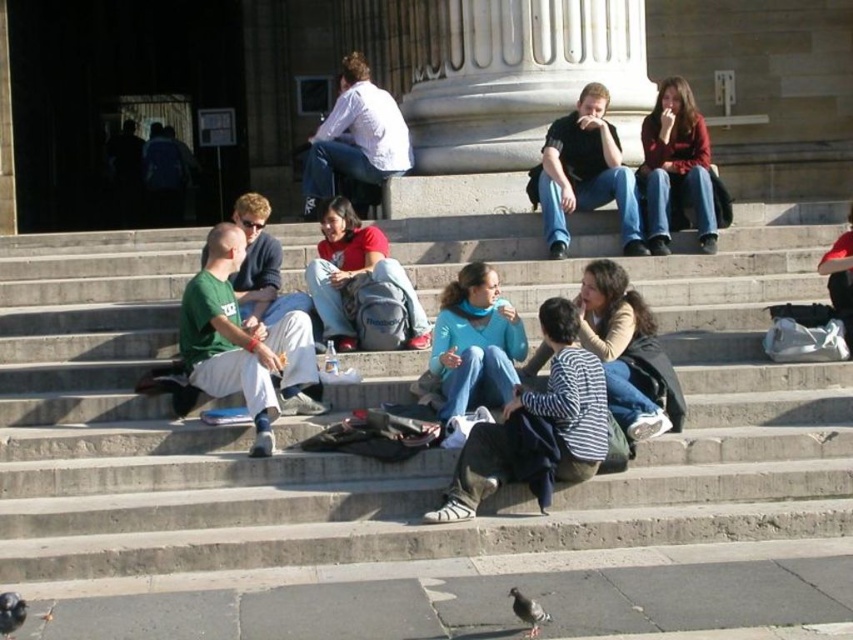
You are standing on the stone steps and want to feed both pigeons. Which pigeon, the gray matte pigeon at lower left or the gray matte pigeon at lower center, is closer to you?

The gray matte pigeon at lower left is closer to you because it is further to the viewer than the gray matte pigeon at lower center.

You are standing at the entrance of the building and want to go down to the street level. There are concrete stairs at center located at point [376,404]. Can you use them to reach the street level?

Yes, the concrete stairs at center located at point [376,404] are the way down to the street level.